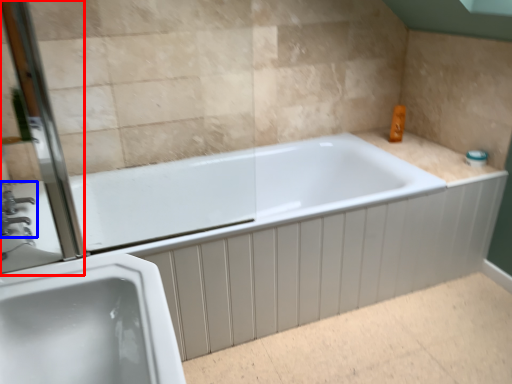
Question: Among these objects, which one is farthest to the camera, screen door (highlighted by a red box) or tap (highlighted by a blue box)?

Choices:
 (A) screen door
 (B) tap

Answer: (B)